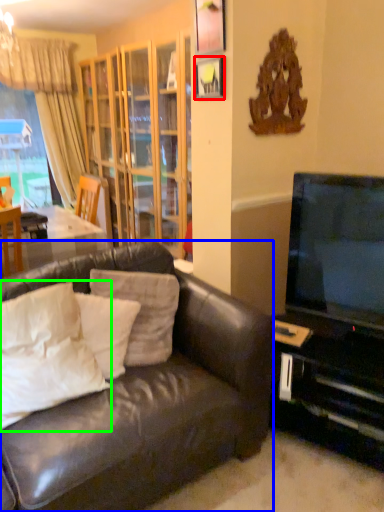
Question: Based on their relative distances, which object is nearer to picture frame (highlighted by a red box)? Choose from studio couch (highlighted by a blue box) and pillow (highlighted by a green box).

Choices:
 (A) studio couch
 (B) pillow

Answer: (A)